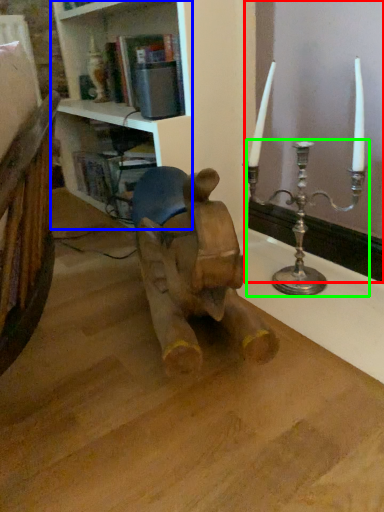
Question: Which object is the closest to the window frame (highlighted by a red box)? Choose among these: shelf (highlighted by a blue box) or candle holder (highlighted by a green box).

Choices:
 (A) shelf
 (B) candle holder

Answer: (B)